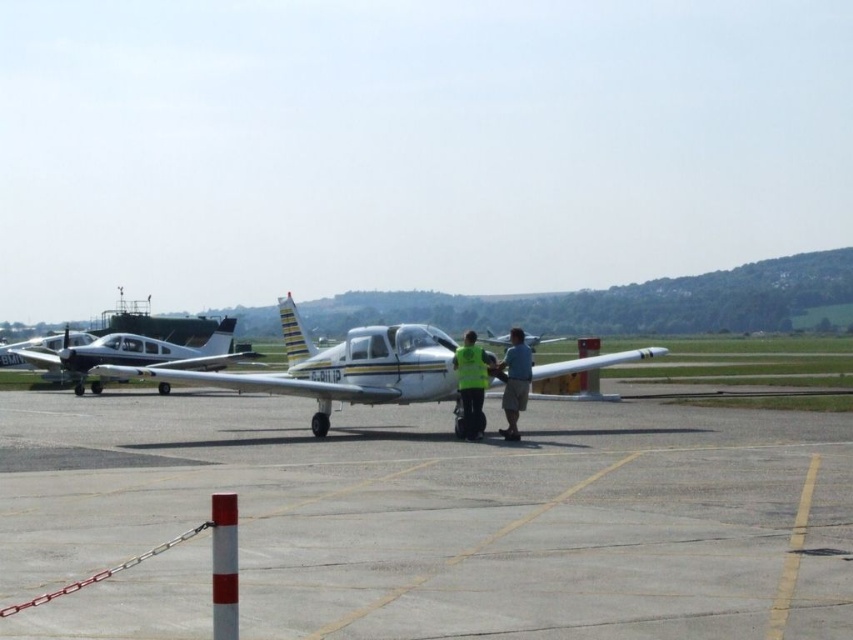
Looking at this image, you are a maintenance worker on the airport tarmac. You need to inspect both the white glossy airplane at center and the white glossy airplane at left. Which airplane requires a taller ladder for inspection?

The white glossy airplane at center requires a taller ladder because it is much taller than the white glossy airplane at left.

From the picture: You are a maintenance technician assessing the clearance requirements for a new overhead structure being installed on the airport tarmac. You observe the white glossy airplane at center and the blue fabric shirt at center. Based on their relative heights, will the airplane require any adjustments to its current position to ensure it fits under the proposed structure?

The white glossy airplane at center has a greater height compared to the blue fabric shirt at center, so the airplane will likely require adjustments to its current position to ensure it fits under the proposed overhead structure, as its height exceeds that of the shirt, which may indicate the minimum clearance needed.

You are a maintenance worker on the airport tarmac. You need to inspect the white glossy airplane at left. To reach it, you have to walk from the smooth asphalt tarmac at center. Which direction should you walk to get to the airplane?

The smooth asphalt tarmac at center is positioned under the white glossy airplane at left, so you should walk towards the left to reach the airplane.